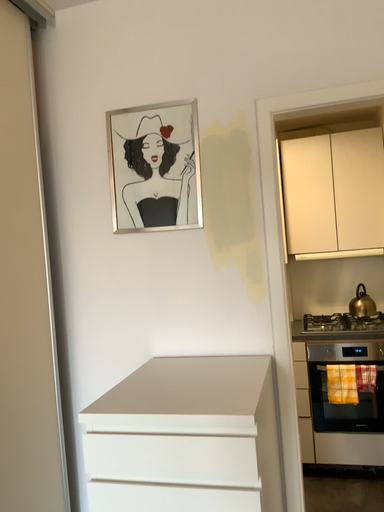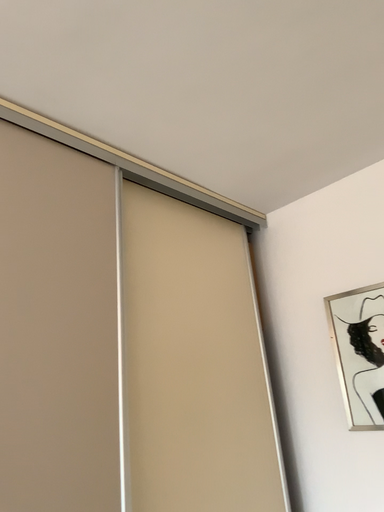
Question: Which way did the camera rotate in the video?

Choices:
 (A) rotated right
 (B) rotated left

Answer: (B)